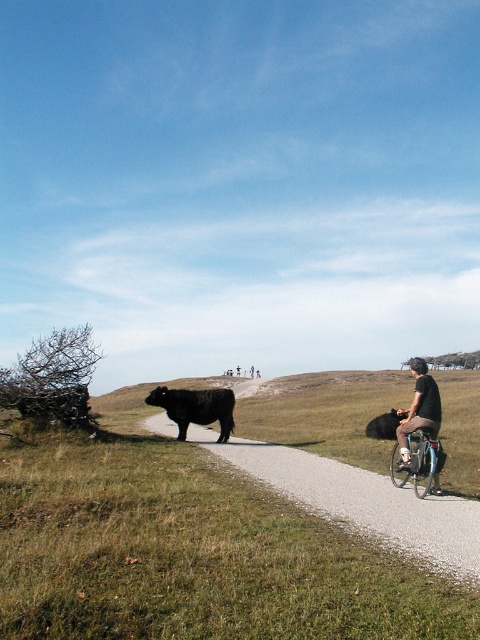
You are standing at the point with coordinates point (384, 424) and want to walk towards the point (424, 392). Which direction should you face to move directly towards it?

Since point (424, 392) is closer to the viewer than point (384, 424), you should face towards the direction of the viewer to move directly towards it.